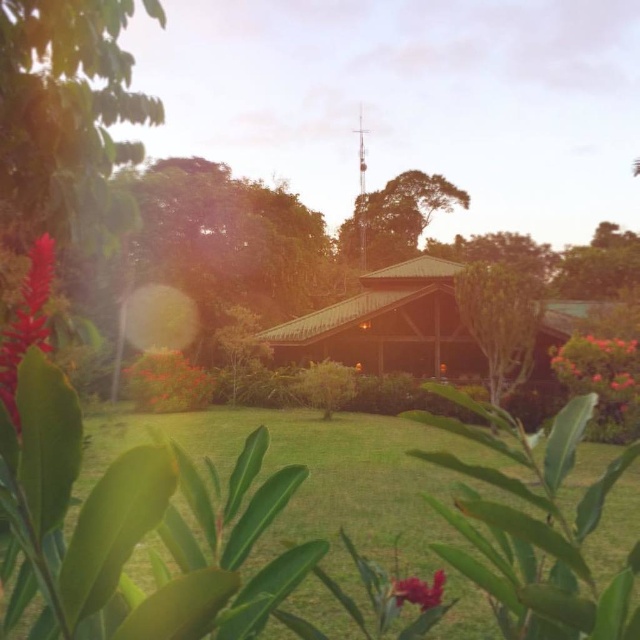
Question: Which of the following is the farthest from the observer?

Choices:
 (A) green leafy tree at center
 (B) bright pink petals at right
 (C) bright red flower at left
 (D) green wooden hut at center

Answer: (A)

Question: Can you confirm if green grass at center is positioned above bright red flower at left?

Choices:
 (A) no
 (B) yes

Answer: (A)

Question: Which object appears closest to the camera in this image?

Choices:
 (A) green wooden hut at center
 (B) green textured roof at center
 (C) bright red flower at left
 (D) green grass at center

Answer: (C)

Question: Can you confirm if green wooden hut at center is positioned above green leafy tree at center?

Choices:
 (A) no
 (B) yes

Answer: (B)

Question: Does green textured roof at center appear under bright pink petals at right?

Choices:
 (A) yes
 (B) no

Answer: (B)

Question: Which object is positioned farthest from the green textured roof at center?

Choices:
 (A) green leafy tree at center
 (B) matte red flower at lower center
 (C) green wooden hut at center

Answer: (B)